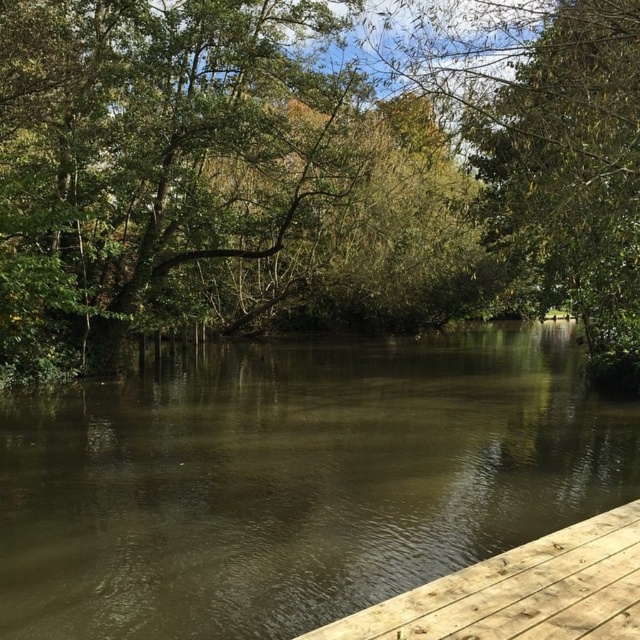
You are standing at the edge of the wooden dock on the right side of the image. You want to step onto the point marked at coordinates (294,481). Based on the scene description, what will you step into?

The point at coordinates (294,481) is brown murky water at center, so stepping there would place you into the brown murky water at center.

You are a kayaker planning to paddle from the green leafy tree at center to the brown murky water at center. Given that your kayak requires at least 5 meters of space to maneuver safely, can you navigate between them?

The distance between the green leafy tree at center and the brown murky water at center is 6.12 meters, which is more than the 5 meters required for safe maneuvering. Therefore, you can safely navigate between them.

You are standing on the wooden dock on the right side of the frame and want to cross to the opposite side. The brown murky water at center is in your path. Can you step around it to reach the other side without getting your feet wet?

The brown murky water at center is located at point [294,481], which is directly in the center of the image. Since you are on the wooden dock on the right, you can walk along the dock to bypass the water and reach the opposite side without stepping into the water.